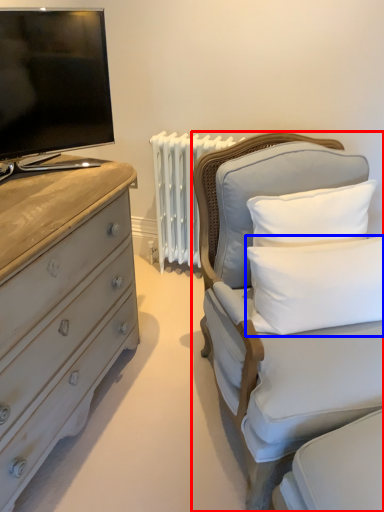
Question: Which object appears farthest to the camera in this image, furniture (highlighted by a red box) or pillow (highlighted by a blue box)?

Choices:
 (A) furniture
 (B) pillow

Answer: (B)